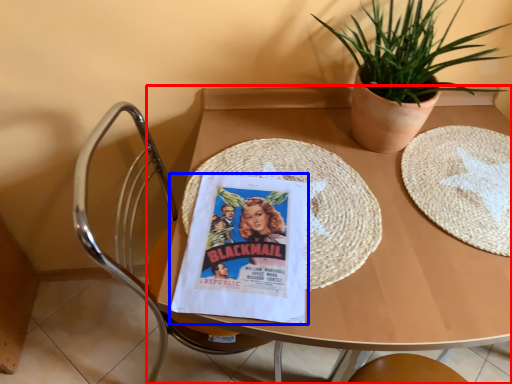
Question: Which of the following is the closest to the observer, table (highlighted by a red box) or comic book (highlighted by a blue box)?

Choices:
 (A) table
 (B) comic book

Answer: (A)